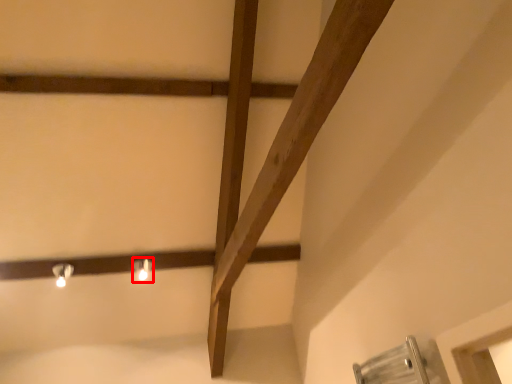
Question: From the image, what is the correct spatial relationship of light fixture (annotated by the red box) in relation to light fixture?

Choices:
 (A) right
 (B) left

Answer: (A)